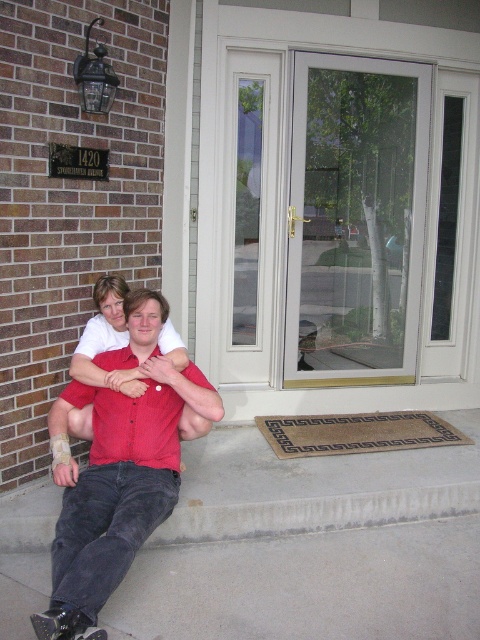
Consider the image. Does matte red shirt at center appear under braided coir mat at lower center?

Actually, matte red shirt at center is above braided coir mat at lower center.

Does matte red shirt at center appear on the left side of braided coir mat at lower center?

Yes, matte red shirt at center is to the left of braided coir mat at lower center.

Who is more distant from viewer, (119, 392) or (296, 449)?

Point (296, 449)

Find the location of `matte red shirt at center`. matte red shirt at center is located at coordinates (134, 401).

Is braided coir mat at lower center shorter than black rubber skateboard at lower left?

No, braided coir mat at lower center is not shorter than black rubber skateboard at lower left.

This screenshot has height=640, width=480. I want to click on braided coir mat at lower center, so click(356, 433).

Can you confirm if matte red shirt at center is shorter than black rubber skateboard at lower left?

No.

Is point (136, 324) closer to camera compared to point (69, 630)?

No, it is not.

Which is behind, point (153, 417) or point (48, 625)?

The point (153, 417) is behind.

Where is `matte red shirt at center`? This screenshot has height=640, width=480. matte red shirt at center is located at coordinates (134, 401).